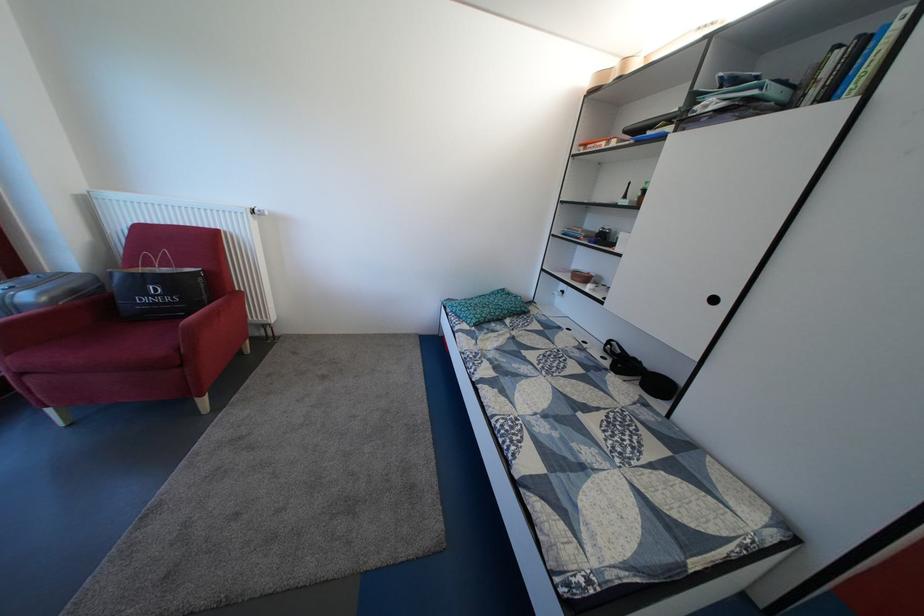
You are a GUI agent. You are given a task and a screenshot of the screen. Output one action in this format:
    pyautogui.click(x=<x>, y=<y>)
    Task: Click on the black paper bag
    The height and width of the screenshot is (616, 924).
    Given the screenshot: What is the action you would take?
    pyautogui.click(x=157, y=289)